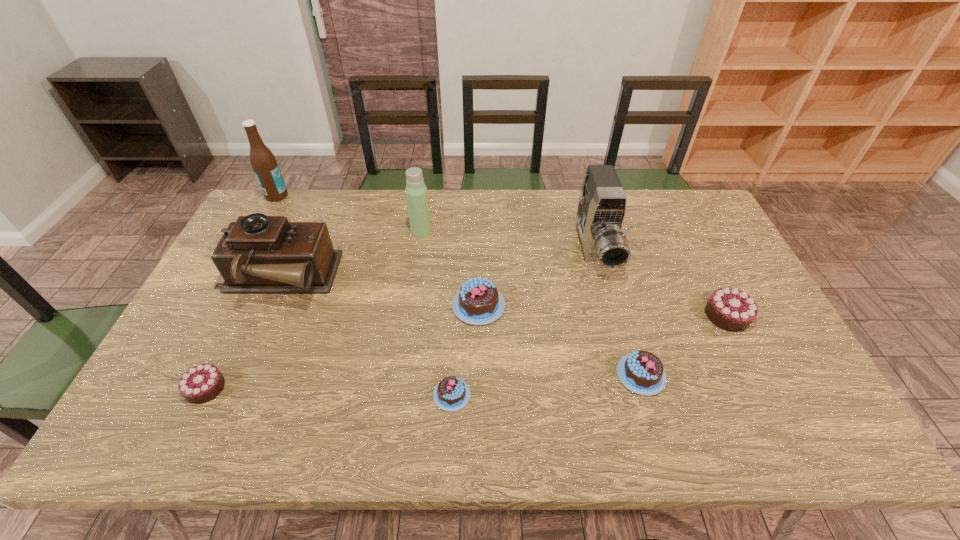
Locate which chocolate cake is the second closest to the farthest pink chocolate cake. Please provide its 2D coordinates. Your answer should be formatted as a tuple, i.e. [(x, y)], where the tuple contains the x and y coordinates of a point satisfying the conditions above.

[(642, 372)]

Identify which pink chocolate cake is located as the third nearest to the thermos bottle. Please provide its 2D coordinates. Your answer should be formatted as a tuple, i.e. [(x, y)], where the tuple contains the x and y coordinates of a point satisfying the conditions above.

[(642, 372)]

Find the location of a particular element. pink chocolate cake that stands as the second closest to the farthest object is located at coordinates (451, 394).

This screenshot has height=540, width=960. Identify the location of free location that satisfies the following two spatial constraints: 1. on the back side of the biggest pink chocolate cake; 2. on the horn of the phonograph_record. (479, 280).

I want to click on vacant region that satisfies the following two spatial constraints: 1. on the back side of the fourth object from left to right; 2. on the right side of the left chocolate chocolate cake, so click(x=282, y=231).

Where is `free space that satisfies the following two spatial constraints: 1. on the front side of the beer bottle; 2. on the left side of the farther chocolate chocolate cake`? free space that satisfies the following two spatial constraints: 1. on the front side of the beer bottle; 2. on the left side of the farther chocolate chocolate cake is located at coordinates (212, 315).